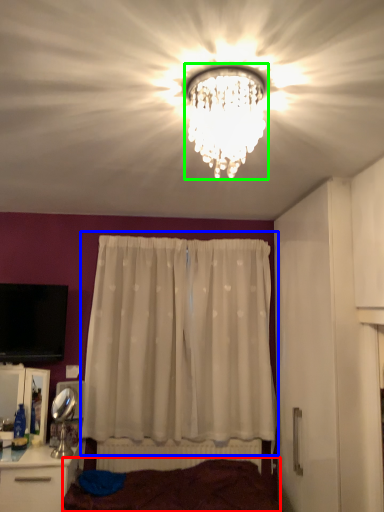
Question: Which object is the farthest from bed frame (highlighted by a red box)? Choose among these: curtain (highlighted by a blue box) or lamp (highlighted by a green box).

Choices:
 (A) curtain
 (B) lamp

Answer: (B)